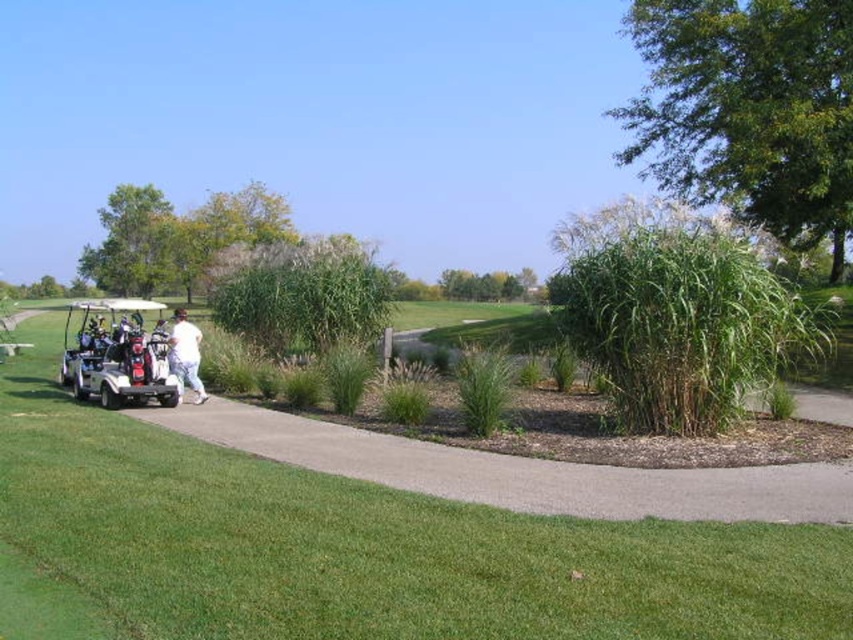
Does green grass at center appear under white plastic golf cart at left?

Yes, green grass at center is below white plastic golf cart at left.

Does point (390, 508) lie behind point (134, 358)?

No, (390, 508) is in front of (134, 358).

Is point (103, 620) farther from viewer compared to point (105, 369)?

No, (103, 620) is in front of (105, 369).

Locate an element on the screen. The height and width of the screenshot is (640, 853). green grass at center is located at coordinates (351, 548).

What do you see at coordinates (520, 472) in the screenshot? I see `gray concrete path at center` at bounding box center [520, 472].

Does gray concrete path at center lie in front of white plastic golf cart at left?

Yes, it is in front of white plastic golf cart at left.

Locate an element on the screen. Image resolution: width=853 pixels, height=640 pixels. gray concrete path at center is located at coordinates (520, 472).

Does white plastic golf cart at left appear under white cotton pants at center?

No.

The width and height of the screenshot is (853, 640). What do you see at coordinates (117, 355) in the screenshot?
I see `white plastic golf cart at left` at bounding box center [117, 355].

Where is `white plastic golf cart at left`? The height and width of the screenshot is (640, 853). white plastic golf cart at left is located at coordinates [117, 355].